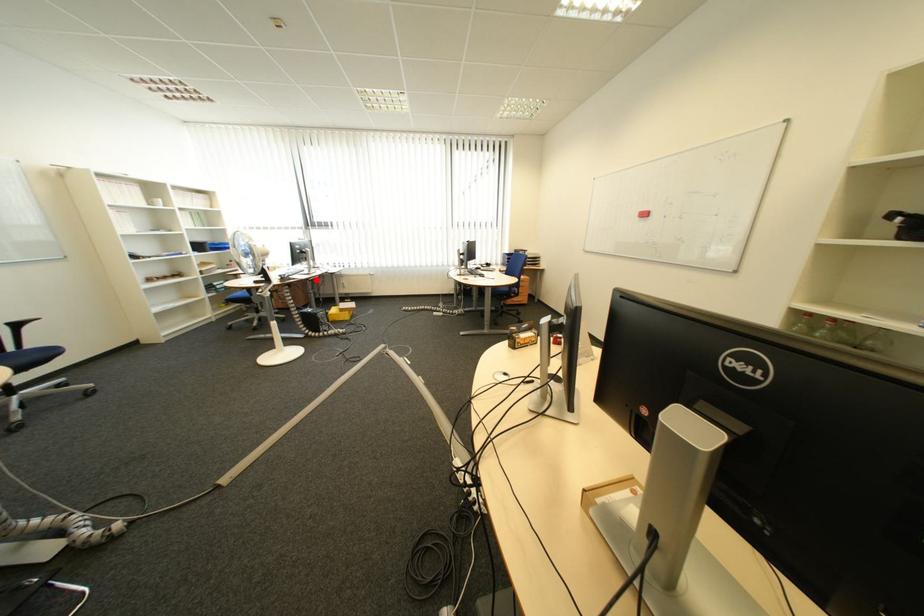
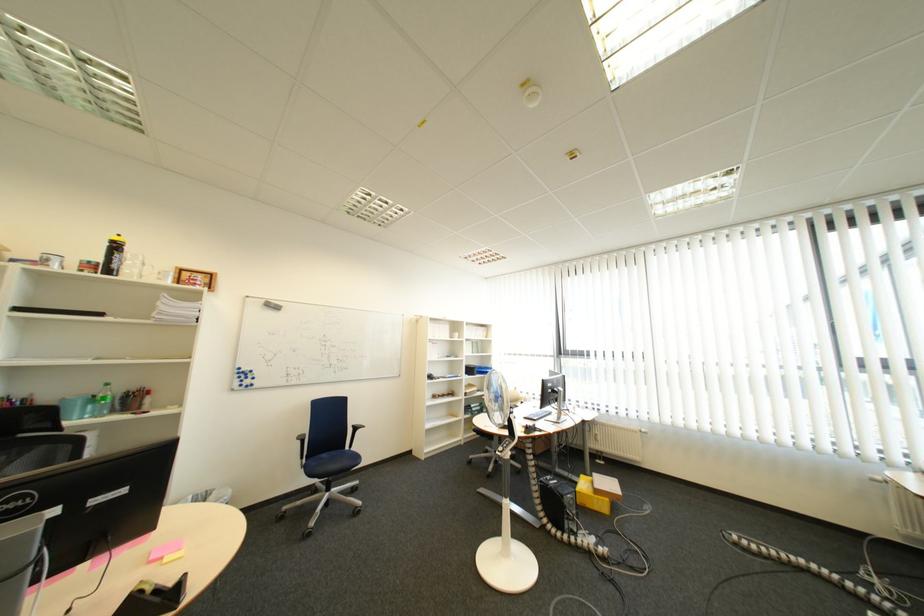
Question: I am providing you with two images of the same scene from different viewpoints. In image1, a red point is highlighted. Considering the same 3D point in image2, which of the following is correct?

Choices:
 (A) It is closer
 (B) It is farther

Answer: (B)